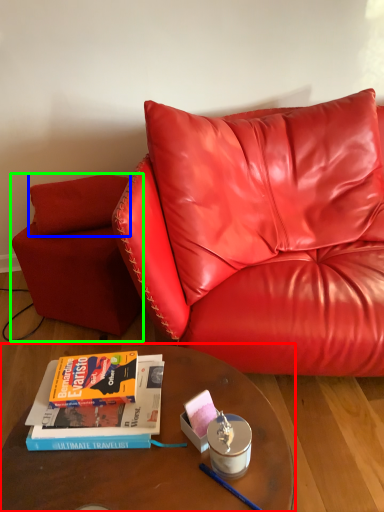
Question: Based on their relative distances, which object is nearer to table (highlighted by a red box)? Choose from pillow (highlighted by a blue box) and armchair (highlighted by a green box).

Choices:
 (A) pillow
 (B) armchair

Answer: (B)